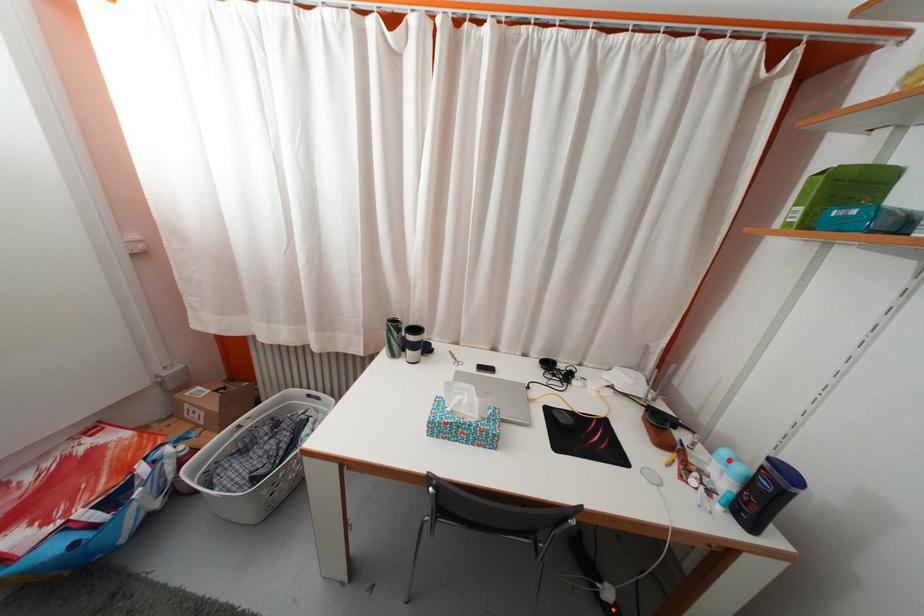
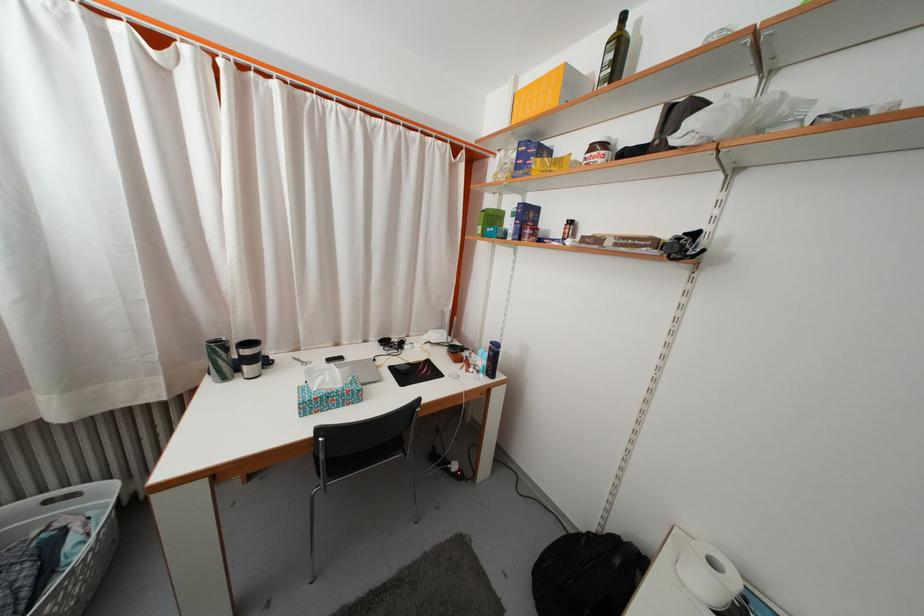
Find the pixel in the second image that matches the highlighted location in the first image.

(485, 359)